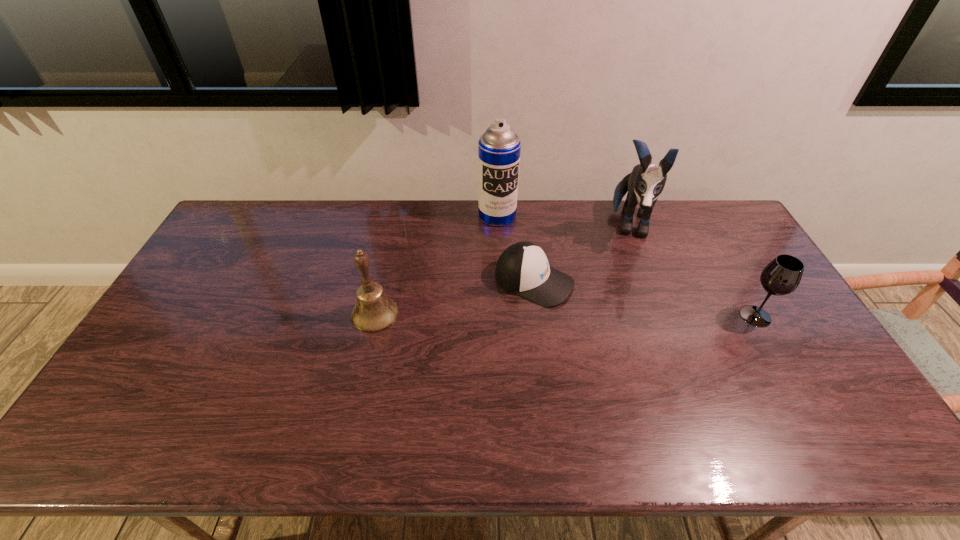
Identify the location of free space that is in between the rightmost object and the second object from right to left. (692, 271).

Where is `vacant area that lies between the shortest object and the leftmost object`? vacant area that lies between the shortest object and the leftmost object is located at coordinates (455, 298).

This screenshot has height=540, width=960. I want to click on empty space between the aerosol can and the second object from right to left, so click(564, 220).

Find the location of a particular element. vacant region between the shortest object and the rightmost object is located at coordinates (645, 299).

Image resolution: width=960 pixels, height=540 pixels. In order to click on object that is the fourth closest one to the rightmost object in this screenshot , I will do `click(374, 312)`.

The height and width of the screenshot is (540, 960). What are the coordinates of `object that stands as the third closest to the leftmost object` in the screenshot? It's located at (645, 183).

You are a GUI agent. You are given a task and a screenshot of the screen. Output one action in this format:
    pyautogui.click(x=<x>, y=<y>)
    Task: Click on the vacant area in the image that satisfies the following two spatial constraints: 1. on the front side of the fourth tallest object; 2. on the left side of the aerosol can
    Image resolution: width=960 pixels, height=540 pixels.
    Given the screenshot: What is the action you would take?
    pyautogui.click(x=502, y=316)

The height and width of the screenshot is (540, 960). In order to click on vacant area in the image that satisfies the following two spatial constraints: 1. on the front side of the leftmost object; 2. on the left side of the wineglass in this screenshot , I will do `click(374, 316)`.